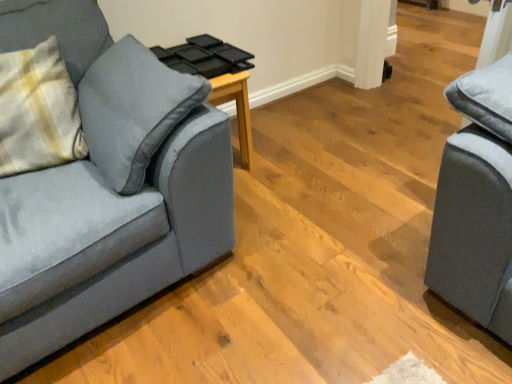
Question: From a real-world perspective, is wooden side table at center located higher than velvet gray couch at left?

Choices:
 (A) yes
 (B) no

Answer: (B)

Question: Considering the relative positions of wooden side table at center and velvet gray couch at left in the image provided, is wooden side table at center to the left of velvet gray couch at left from the viewer's perspective?

Choices:
 (A) yes
 (B) no

Answer: (B)

Question: Are wooden side table at center and velvet gray couch at left making contact?

Choices:
 (A) yes
 (B) no

Answer: (B)

Question: Is wooden side table at center located outside velvet gray couch at left?

Choices:
 (A) yes
 (B) no

Answer: (A)

Question: From a real-world perspective, is wooden side table at center under velvet gray couch at left?

Choices:
 (A) yes
 (B) no

Answer: (A)

Question: Is wooden side table at center turned away from velvet gray couch at left?

Choices:
 (A) yes
 (B) no

Answer: (B)

Question: From the image's perspective, is velvet gray couch at left under wooden side table at center?

Choices:
 (A) no
 (B) yes

Answer: (B)

Question: From a real-world perspective, does velvet gray couch at left stand above wooden side table at center?

Choices:
 (A) yes
 (B) no

Answer: (A)

Question: Does velvet gray couch at left appear on the left side of wooden side table at center?

Choices:
 (A) no
 (B) yes

Answer: (B)

Question: Considering the relative sizes of velvet gray couch at left and wooden side table at center in the image provided, is velvet gray couch at left taller than wooden side table at center?

Choices:
 (A) no
 (B) yes

Answer: (B)

Question: Can you confirm if velvet gray couch at left is positioned to the right of wooden side table at center?

Choices:
 (A) no
 (B) yes

Answer: (A)

Question: Can you see velvet gray couch at left touching wooden side table at center?

Choices:
 (A) yes
 (B) no

Answer: (B)

Question: Is wooden side table at center not within plaid fabric pillow at left?

Choices:
 (A) no
 (B) yes

Answer: (B)